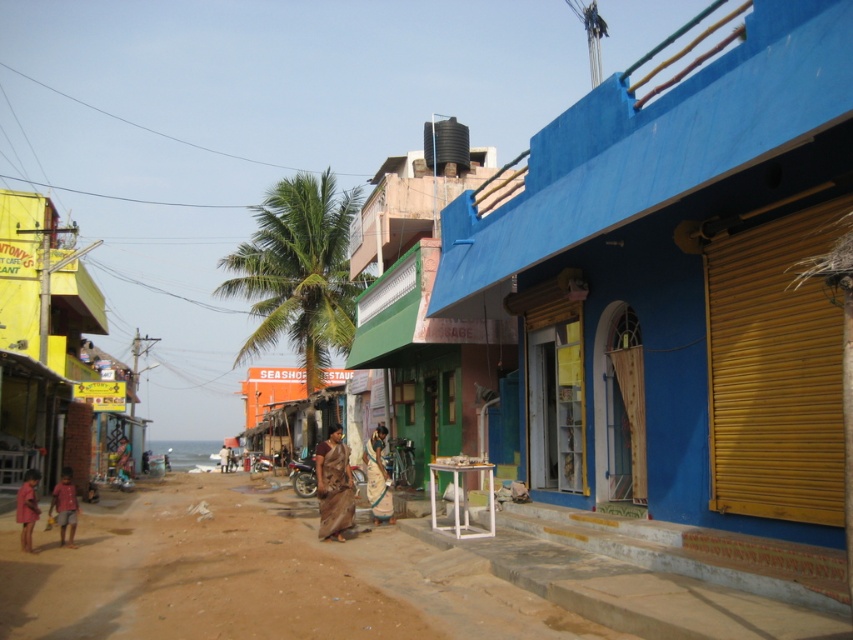
Looking at this image, you are a delivery person trying to navigate through the brown sandy dirt track at lower left and the green leafy palm tree at center. Which path has more space for your vehicle?

The brown sandy dirt track at lower left occupies less space than the green leafy palm tree at center, so the green leafy palm tree at center has more space for your vehicle.

In the scene shown: You are a tourist standing on the dirt road in the coastal town. You see a green leafy palm tree at center and a brown fabric saree at center. Which object is closer to you?

The green leafy palm tree at center is closer to you because the brown fabric saree at center is behind it.

You are standing at the entrance of the blue building with a yellow rolling shutter door on the right side of the image. You want to walk straight ahead towards the center of the image. Will you pass by the green leafy palm tree at center before reaching the middle of the dirt road?

The green leafy palm tree at center is located at coordinates point (x=299, y=272). Since you are starting at the entrance of the blue building on the right, walking straight ahead towards the center would mean moving towards the palm tree first before reaching the middle of the dirt road. Therefore, yes, you will pass by the green leafy palm tree at center before reaching the middle of the dirt road.